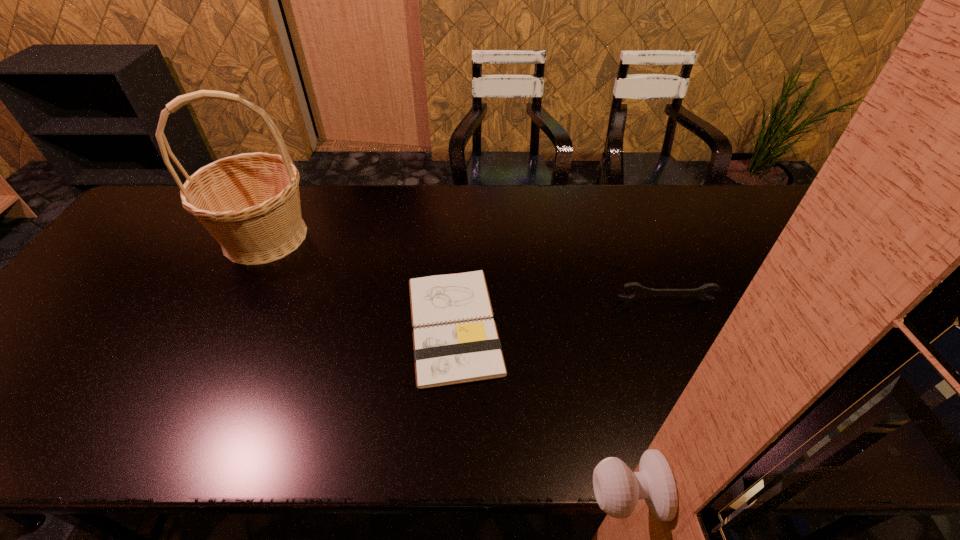
I want to click on the farthest object, so click(x=250, y=203).

Locate an element on the screen. the leftmost object is located at coordinates (250, 203).

Locate an element on the screen. the second shortest object is located at coordinates (641, 292).

Identify the location of the rightmost object. (641, 292).

Image resolution: width=960 pixels, height=540 pixels. What are the coordinates of `the shortest object` in the screenshot? It's located at (455, 341).

Find the location of `the second object from right to left`. the second object from right to left is located at coordinates (455, 341).

I want to click on free space located on the right of the tallest object, so click(398, 237).

Locate an element on the screen. The height and width of the screenshot is (540, 960). vacant region located 0.270m on the open ends of the rightmost object is located at coordinates (702, 395).

What are the coordinates of `free space located 0.100m on the left of the notepad` in the screenshot? It's located at (363, 325).

The width and height of the screenshot is (960, 540). I want to click on object located in the far edge section of the desktop, so point(250,203).